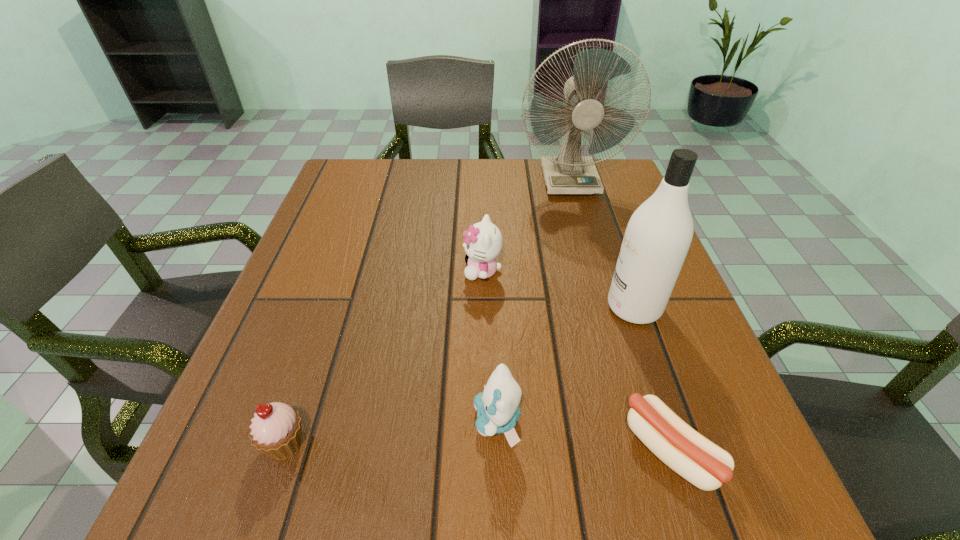
Identify the location of sausage situated at the near edge. (695, 458).

Where is `object that is at the left edge`? object that is at the left edge is located at coordinates (276, 431).

The image size is (960, 540). What are the coordinates of `fan that is at the right edge` in the screenshot? It's located at (568, 173).

Where is `shampoo present at the right edge`? This screenshot has width=960, height=540. shampoo present at the right edge is located at coordinates 657,238.

Find the location of `sausage that is at the right edge`. sausage that is at the right edge is located at coordinates (695, 458).

Find the location of a particular element. The image size is (960, 540). object that is at the near left corner is located at coordinates (276, 431).

Identify the location of object located at the far right corner. (568, 173).

This screenshot has height=540, width=960. Find the location of `object that is at the near right corner`. object that is at the near right corner is located at coordinates (695, 458).

Identify the location of vacant area at the far edge of the desktop. The width and height of the screenshot is (960, 540). (392, 195).

Locate an element on the screen. This screenshot has height=540, width=960. vacant space at the near edge is located at coordinates (551, 479).